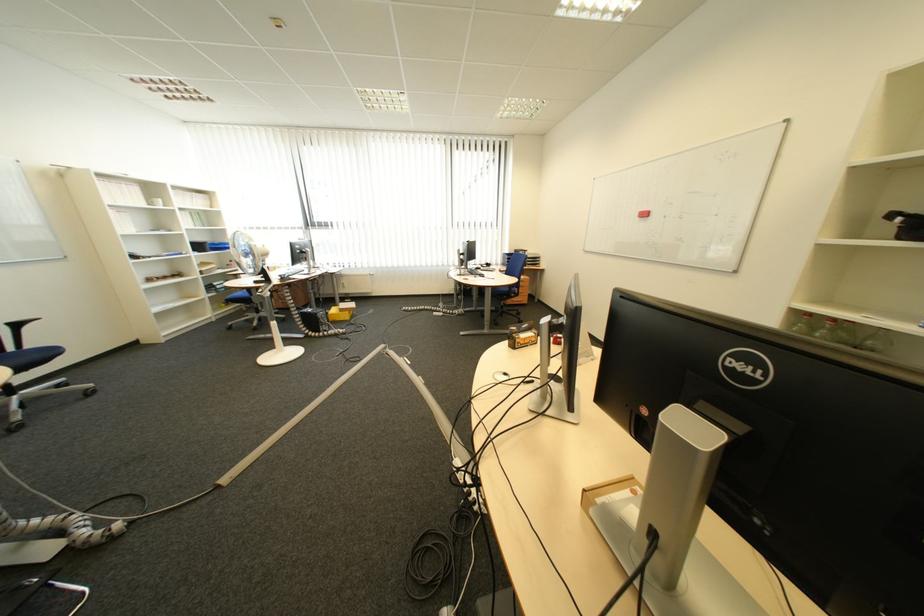
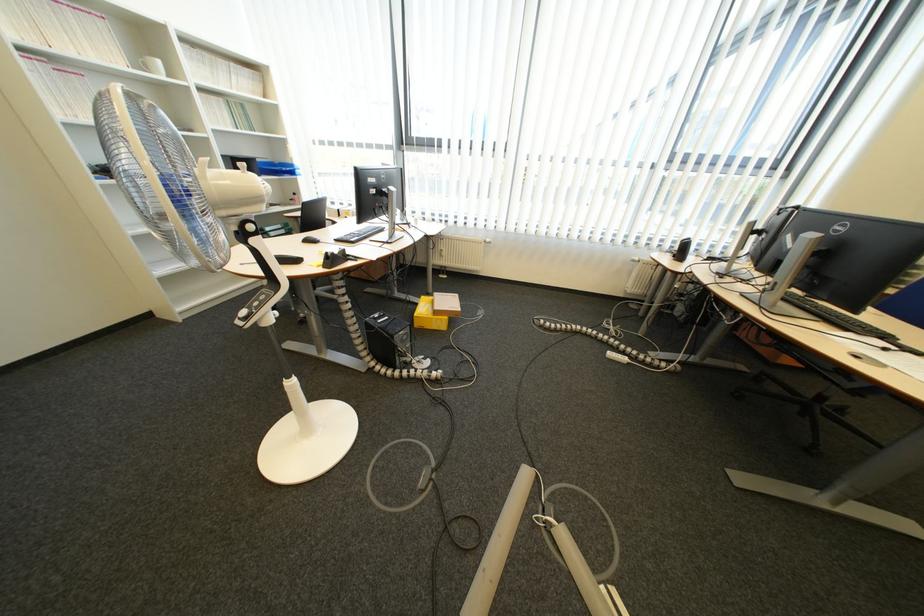
Locate, in the second image, the point that corresponds to (x=229, y=244) in the first image.

(289, 163)